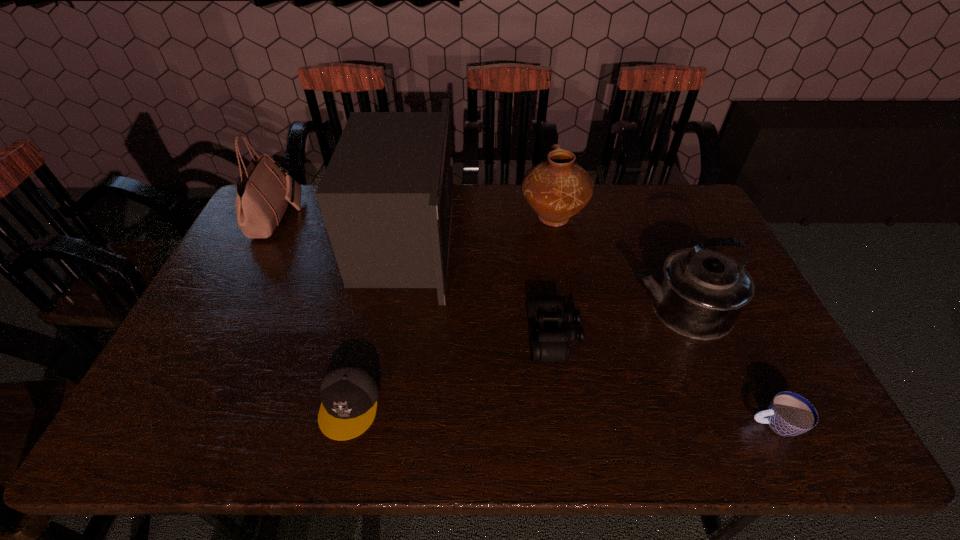
Identify the location of vacant space at the left edge of the desktop. The image size is (960, 540). (246, 236).

This screenshot has height=540, width=960. Identify the location of vacant space at the right edge. (756, 368).

What are the coordinates of `free location at the far right corner of the desktop` in the screenshot? It's located at coord(681,200).

This screenshot has height=540, width=960. I want to click on blank region between the kettle and the binoculars, so click(616, 321).

The width and height of the screenshot is (960, 540). I want to click on free space between the leftmost object and the shortest object, so click(x=525, y=321).

The height and width of the screenshot is (540, 960). Find the location of `vacant region between the binoculars and the pottery`. vacant region between the binoculars and the pottery is located at coordinates (553, 276).

At what (x,y) coordinates should I click in order to perform the action: click on free space between the binoculars and the cup. Please return your answer as a coordinate pair (x, y). This screenshot has width=960, height=540. Looking at the image, I should click on (663, 379).

Where is `free area in between the microwave oven and the binoculars`? Image resolution: width=960 pixels, height=540 pixels. free area in between the microwave oven and the binoculars is located at coordinates (480, 287).

Identify the location of vacant area that lies between the leftmost object and the kettle. (478, 263).

In order to click on empty space between the cup and the binoculars in this screenshot , I will do `click(663, 379)`.